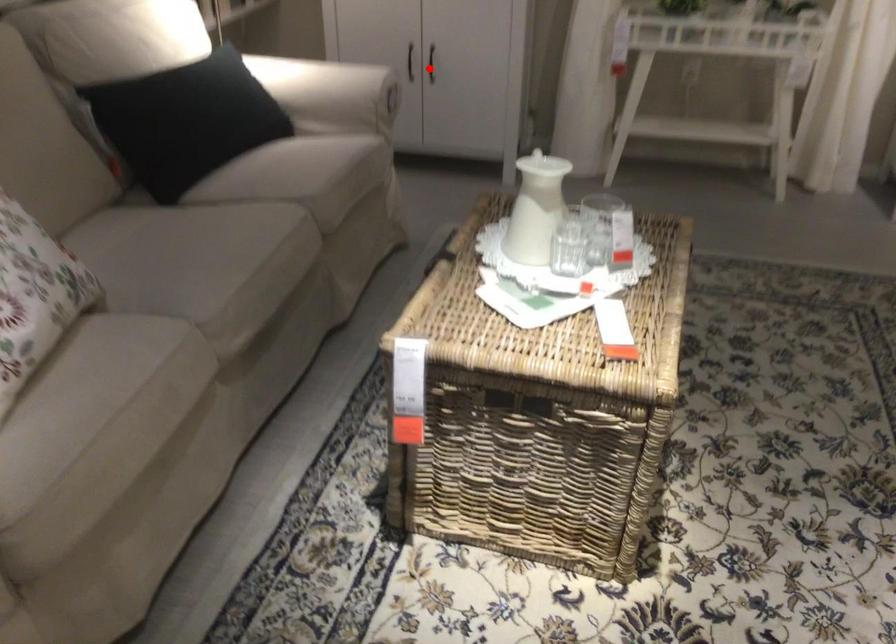
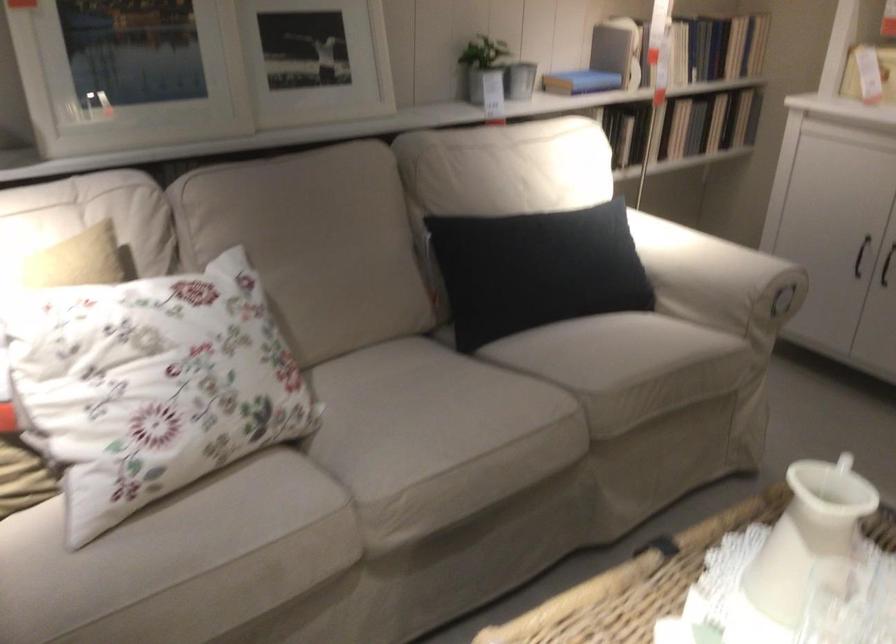
Find the pixel in the second image that matches the highlighted location in the first image.

(886, 265)